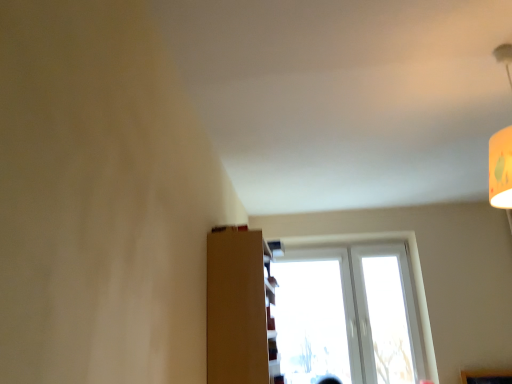
What do you see at coordinates (240, 309) in the screenshot? I see `brown matte shelf at center` at bounding box center [240, 309].

In order to face brown matte shelf at center, should I rotate leftwards or rightwards?

To align with it, rotate left about 1.129°.

This screenshot has width=512, height=384. Identify the location of brown matte shelf at center. (240, 309).

Locate an element on the screen. This screenshot has height=384, width=512. white plastic window at center is located at coordinates (347, 315).

In order to face white plastic window at center, should I rotate leftwards or rightwards?

To face it directly, rotate right by 12.391 degrees.

The height and width of the screenshot is (384, 512). What do you see at coordinates (347, 315) in the screenshot?
I see `white plastic window at center` at bounding box center [347, 315].

This screenshot has height=384, width=512. What are the coordinates of `brown matte shelf at center` in the screenshot? It's located at (240, 309).

Considering the relative positions of brown matte shelf at center and white plastic window at center in the image provided, is brown matte shelf at center to the left of white plastic window at center from the viewer's perspective?

Yes.

Is the depth of brown matte shelf at center less than that of white plastic window at center?

Yes, brown matte shelf at center is closer to the camera.

Is point (264, 361) closer to viewer compared to point (392, 354)?

Yes.

From the image's perspective, is brown matte shelf at center located above or below white plastic window at center?

brown matte shelf at center is situated higher than white plastic window at center in the image.

From a real-world perspective, which is physically above, brown matte shelf at center or white plastic window at center?

white plastic window at center, from a real-world perspective.

Is brown matte shelf at center thinner than white plastic window at center?

In fact, brown matte shelf at center might be wider than white plastic window at center.

Can you confirm if brown matte shelf at center is shorter than white plastic window at center?

Correct, brown matte shelf at center is not as tall as white plastic window at center.

Considering the sizes of brown matte shelf at center and white plastic window at center in the image, is brown matte shelf at center bigger or smaller than white plastic window at center?

Clearly, brown matte shelf at center is smaller in size than white plastic window at center.

Is brown matte shelf at center situated inside white plastic window at center or outside?

The correct answer is: outside.

Can you see brown matte shelf at center touching white plastic window at center?

No, brown matte shelf at center is not touching white plastic window at center.

Is brown matte shelf at center facing towards white plastic window at center?

No, brown matte shelf at center is not aimed at white plastic window at center.

Where is `window above the brown matte shelf at center (from a real-world perspective)`? window above the brown matte shelf at center (from a real-world perspective) is located at coordinates click(x=347, y=315).

Between white plastic window at center and brown matte shelf at center, which one appears on the left side from the viewer's perspective?

From the viewer's perspective, brown matte shelf at center appears more on the left side.

Is white plastic window at center closer to the viewer compared to brown matte shelf at center?

No, it is not.

Is point (410, 289) positioned behind point (250, 230)?

That is True.

From the image's perspective, is white plastic window at center beneath brown matte shelf at center?

Yes, from the image's perspective, white plastic window at center is beneath brown matte shelf at center.

From a real-world perspective, does white plastic window at center stand above brown matte shelf at center?

Yes, from a real-world perspective, white plastic window at center is over brown matte shelf at center

Considering the sizes of objects white plastic window at center and brown matte shelf at center in the image provided, who is wider, white plastic window at center or brown matte shelf at center?

brown matte shelf at center.

Can you confirm if white plastic window at center is shorter than brown matte shelf at center?

No.

Which of these two, white plastic window at center or brown matte shelf at center, is bigger?

white plastic window at center.

Is white plastic window at center not inside brown matte shelf at center?

Yes, white plastic window at center is located beyond the bounds of brown matte shelf at center.

Would you consider white plastic window at center to be distant from brown matte shelf at center?

white plastic window at center is far away from brown matte shelf at center.

Is white plastic window at center turned away from brown matte shelf at center?

No.

Measure the distance between white plastic window at center and brown matte shelf at center.

white plastic window at center is 1.54 meters away from brown matte shelf at center.

What are the coordinates of `shelf above the white plastic window at center (from the image's perspective)` in the screenshot? It's located at (240, 309).

The height and width of the screenshot is (384, 512). I want to click on shelf located on the left of white plastic window at center, so click(x=240, y=309).

Locate an element on the screen. This screenshot has height=384, width=512. window below the brown matte shelf at center (from the image's perspective) is located at coordinates (347, 315).